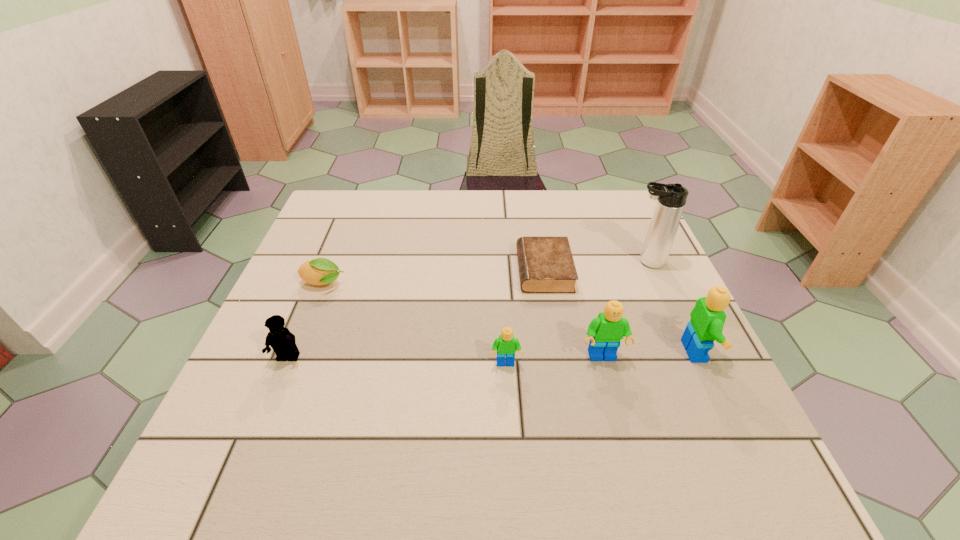
Image resolution: width=960 pixels, height=540 pixels. Find the location of `the second Lego from left to right`. the second Lego from left to right is located at coordinates (506, 345).

This screenshot has height=540, width=960. What are the coordinates of `the third Lego from left to right` in the screenshot? It's located at [605, 332].

Image resolution: width=960 pixels, height=540 pixels. In order to click on the second tallest Lego in this screenshot , I will do `click(605, 332)`.

You are a GUI agent. You are given a task and a screenshot of the screen. Output one action in this format:
    pyautogui.click(x=<x>, y=<y>)
    Task: Click on the rightmost Lego
    
    Given the screenshot: What is the action you would take?
    pyautogui.click(x=707, y=320)

This screenshot has width=960, height=540. In order to click on the second shortest object in this screenshot , I will do `click(320, 271)`.

At what (x,y) coordinates should I click in order to perform the action: click on the shortest object. Please return your answer as a coordinate pair (x, y). The image size is (960, 540). Looking at the image, I should click on (546, 265).

Locate an element on the screen. The height and width of the screenshot is (540, 960). the leftmost Lego is located at coordinates (282, 341).

Identify the location of the tallest object. This screenshot has height=540, width=960. (671, 198).

In order to click on free space located 0.120m on the face of the third object from left to right in this screenshot , I will do `click(509, 424)`.

Locate an element on the screen. The height and width of the screenshot is (540, 960). blank space located on the face of the third tallest object is located at coordinates (611, 387).